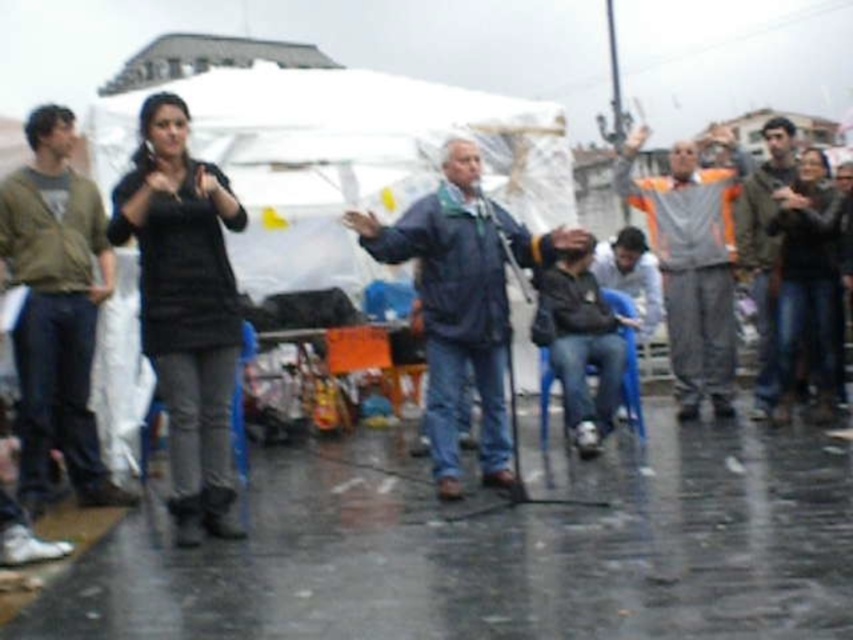
Does point (479, 292) come in front of point (625, 305)?

Yes, it is in front of point (625, 305).

Find the location of a particular element. This screenshot has height=640, width=853. blue denim jacket at center is located at coordinates (463, 301).

Is point (448, 225) positioned in front of point (630, 385)?

Yes.

Identify the location of blue denim jacket at center. This screenshot has width=853, height=640. (463, 301).

Is point (90, 280) positioned after point (770, 209)?

No, it is not.

Who is more forward, (90, 275) or (793, 161)?

Positioned in front is point (90, 275).

Locate an element on the screen. This screenshot has width=853, height=640. matte brown jacket at left is located at coordinates (56, 308).

Between orange reflective vest at center and blue plastic chair at lower center, which one is positioned higher?

orange reflective vest at center is higher up.

Can you confirm if orange reflective vest at center is positioned above blue plastic chair at lower center?

Correct, orange reflective vest at center is located above blue plastic chair at lower center.

Who is more distant from viewer, (727, 326) or (225, 524)?

Positioned behind is point (727, 326).

This screenshot has width=853, height=640. Find the location of `orange reflective vest at center`. orange reflective vest at center is located at coordinates (692, 262).